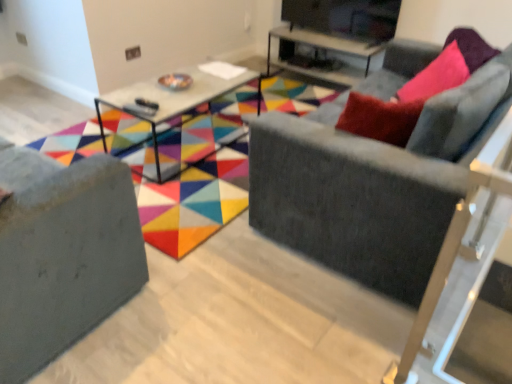
Question: Is velvet gray couch at right, marked as the first studio couch in a right-to-left arrangement, to the left or to the right of matte glass table at center, which is counted as the 2th table, starting from the right, in the image?

Choices:
 (A) left
 (B) right

Answer: (B)

Question: Is velvet gray couch at right, the 2th studio couch when ordered from left to right, situated inside matte glass table at center, which is the 1th table from left to right, or outside?

Choices:
 (A) outside
 (B) inside

Answer: (A)

Question: Which of these objects is positioned closest to the matte black tv stand at upper center?

Choices:
 (A) matte glass table at center, which is counted as the 2th table, starting from the right
 (B) matte gray sofa at center
 (C) velvet grey couch at lower left, the first studio couch in the left-to-right sequence
 (D) velvet gray couch at right, the 2th studio couch when ordered from left to right
 (E) metallic glass table at upper center, which appears as the 1th table when viewed from the back

Answer: (E)

Question: Which is nearer to the matte glass table at center, which is counted as the 2th table, starting from the right?

Choices:
 (A) matte black tv stand at upper center
 (B) velvet grey couch at lower left, the first studio couch in the left-to-right sequence
 (C) matte gray sofa at center
 (D) metallic glass table at upper center, the second table viewed from the front
 (E) velvet gray couch at right, the 2th studio couch when ordered from left to right

Answer: (C)